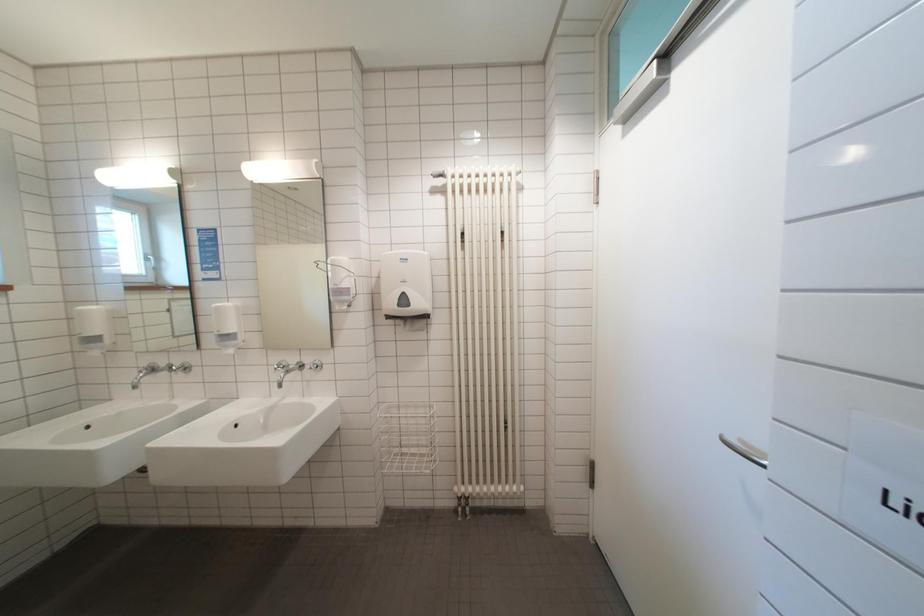
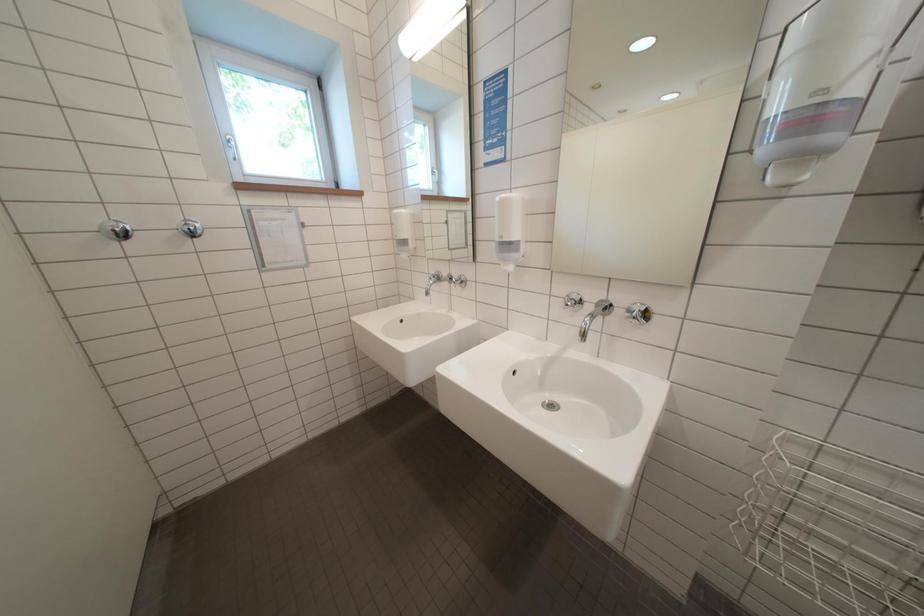
Looking at this image, how did the camera likely rotate?

The rotation direction of the camera is left-down.